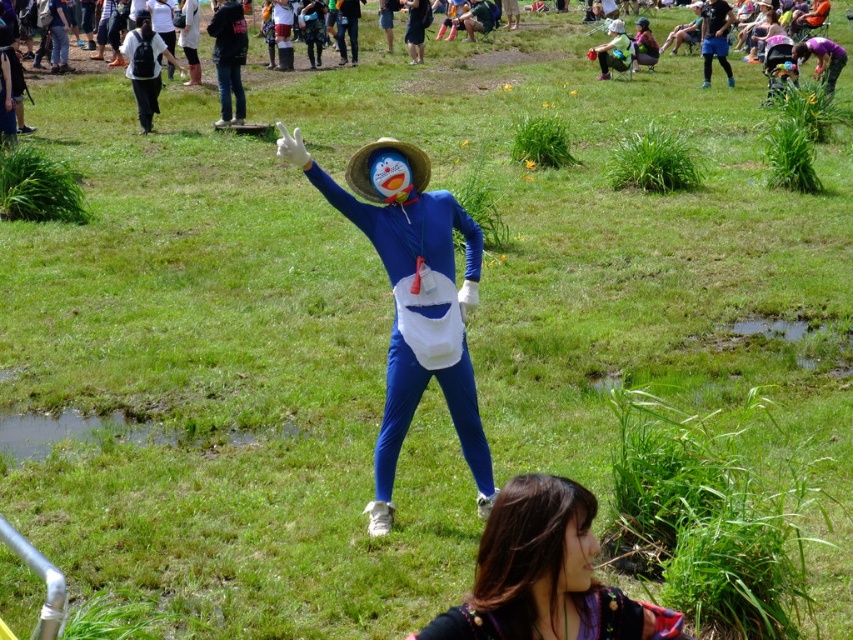
You are standing at the position of the person dressed as Doraemon. You want to move towards the point labeled point (x=326, y=192) and point (x=538, y=561). Which point should you move towards first to reach the closer one?

You should move towards point (x=326, y=192) first because it is closer to you than point (x=538, y=561).

You are standing at the origin point of the coordinate system. You want to walk to the blue matte costume at center. What are the coordinates you need to reach?

The coordinates you need to reach are point [412,300].